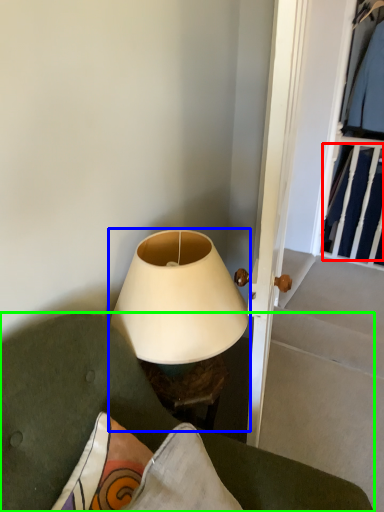
Question: Which object is the closest to the clothing (highlighted by a red box)? Choose among these: lamp (highlighted by a blue box) or furniture (highlighted by a green box).

Choices:
 (A) lamp
 (B) furniture

Answer: (A)